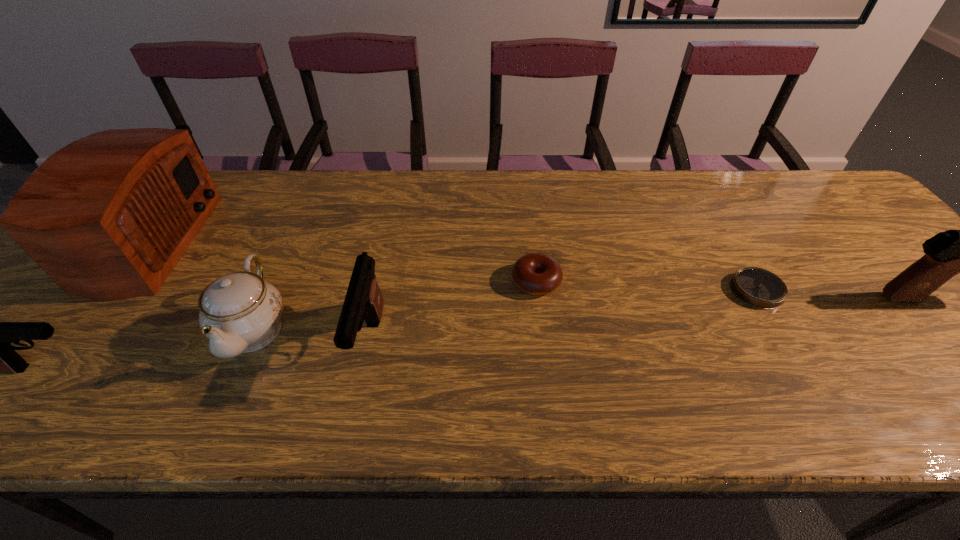
You are a GUI agent. You are given a task and a screenshot of the screen. Output one action in this format:
    pyautogui.click(x=<x>, y=<y>)
    Task: Click on the second shortest pistol
    
    Given the screenshot: What is the action you would take?
    pyautogui.click(x=363, y=300)

Locate an element on the screen. This screenshot has height=540, width=960. the fourth object from left to right is located at coordinates (363, 300).

The height and width of the screenshot is (540, 960). I want to click on radio receiver, so click(107, 217).

Where is `the third object from right to left`? The width and height of the screenshot is (960, 540). the third object from right to left is located at coordinates (535, 273).

Find the location of `doughnut`. doughnut is located at coordinates (535, 273).

In order to click on the second object from right to left in this screenshot , I will do `click(759, 288)`.

At what (x,y) coordinates should I click in order to perform the action: click on compass. Please return your answer as a coordinate pair (x, y). Looking at the image, I should click on (759, 288).

Find the location of `chinaware`. chinaware is located at coordinates (239, 313).

In order to click on vacant area located on the front-facing side of the tallest object in this screenshot , I will do `click(283, 241)`.

Locate an element on the screen. The image size is (960, 540). free space located on the back of the third object from right to left is located at coordinates (530, 230).